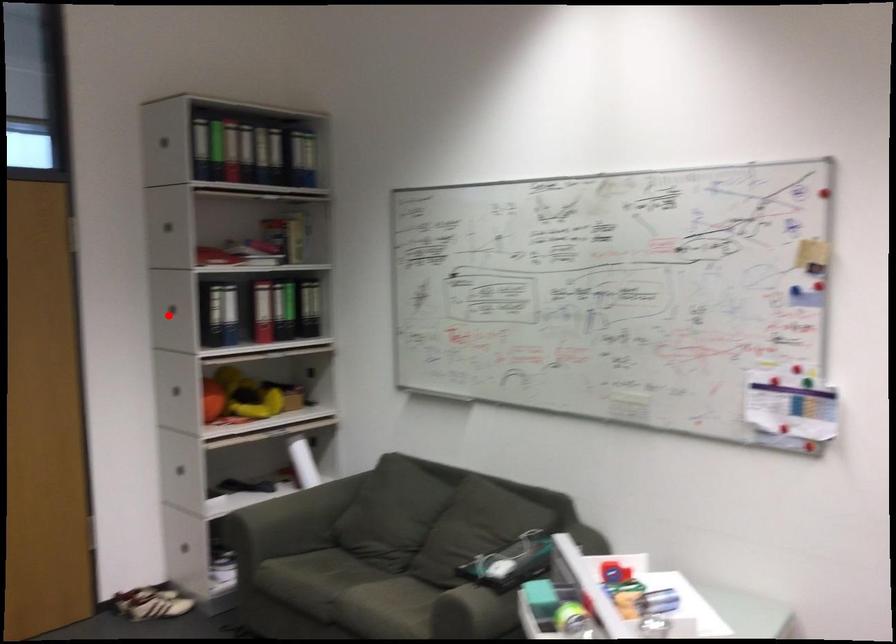
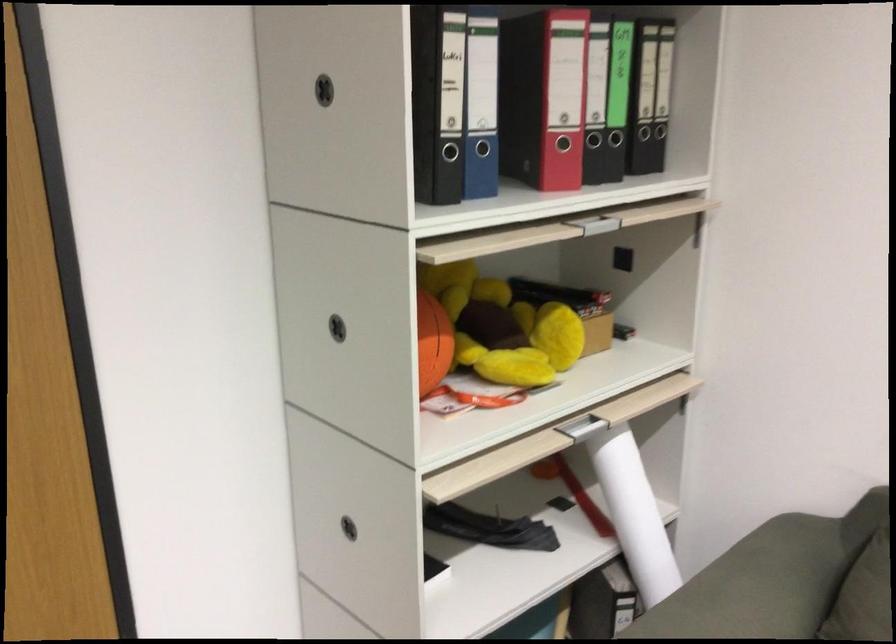
Find the pixel in the second image that matches the highlighted location in the first image.

(326, 86)